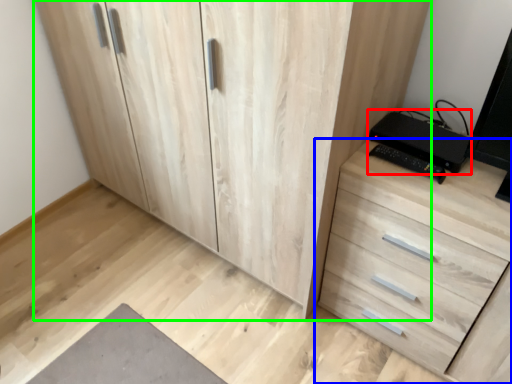
Question: Which is nearer to the computer (highlighted by a red box)? chest of drawers (highlighted by a blue box) or cupboard (highlighted by a green box).

Choices:
 (A) chest of drawers
 (B) cupboard

Answer: (A)